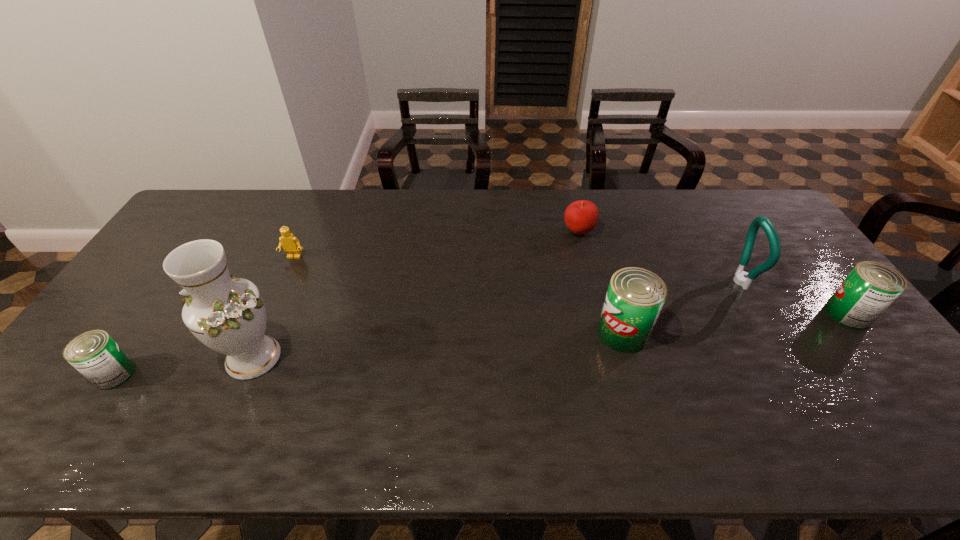
If the aim is uniform spacing by inserting an additional can among them, please point to a vacant space for this new can. Please provide its 2D coordinates. Your answer should be formatted as a tuple, i.e. [(x, y)], where the tuple contains the x and y coordinates of a point satisfying the conditions above.

[(379, 353)]